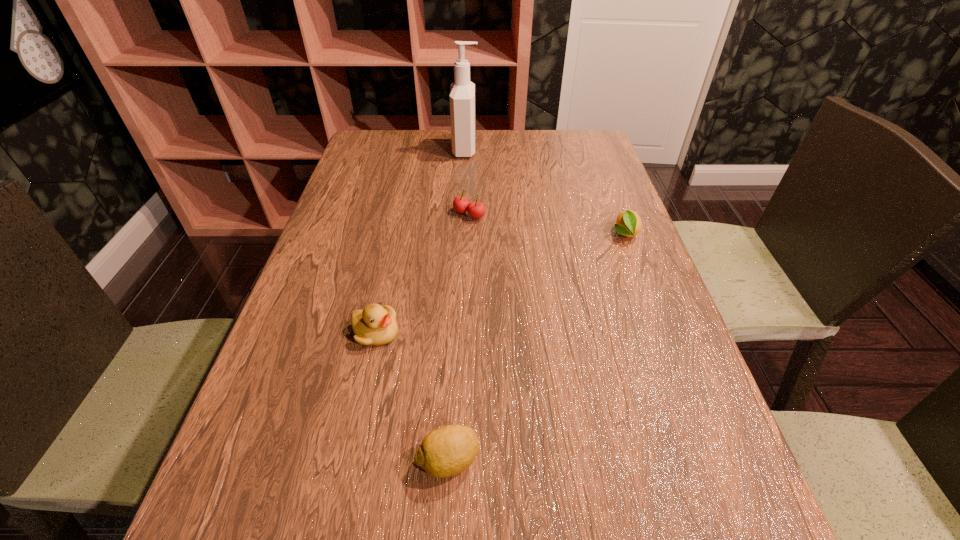
Find the location of a particular element. This screenshot has width=960, height=540. vacant space located on the front-facing side of the duckling is located at coordinates (553, 332).

Locate an element on the screen. free space located on the back of the cherry is located at coordinates (471, 147).

Locate an element on the screen. Image resolution: width=960 pixels, height=540 pixels. free space located 0.150m at the stem end of the nearest object is located at coordinates (581, 461).

Locate an element on the screen. The width and height of the screenshot is (960, 540). free point located 0.180m with leaves positioned above the farther lemon is located at coordinates (651, 305).

Locate an element on the screen. Image resolution: width=960 pixels, height=540 pixels. object that is at the far edge is located at coordinates pos(462,92).

Find the location of a particular element. object that is at the left edge is located at coordinates (375, 325).

Find the location of a particular element. This screenshot has height=540, width=960. object situated at the right edge is located at coordinates (628, 223).

The height and width of the screenshot is (540, 960). In order to click on vacant space at the far edge of the desktop in this screenshot , I will do `click(490, 154)`.

I want to click on vacant position at the left edge of the desktop, so click(351, 208).

I want to click on free space at the right edge, so click(x=603, y=362).